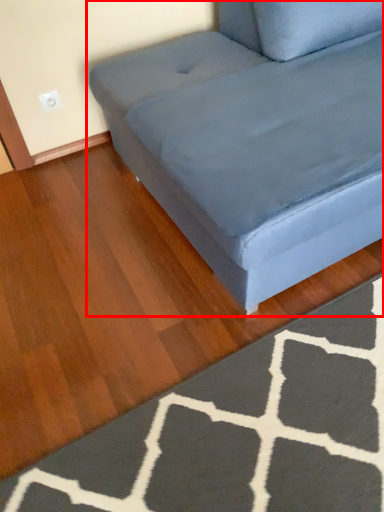
Question: Where is studio couch (annotated by the red box) located in relation to doormat in the image?

Choices:
 (A) left
 (B) right

Answer: (B)